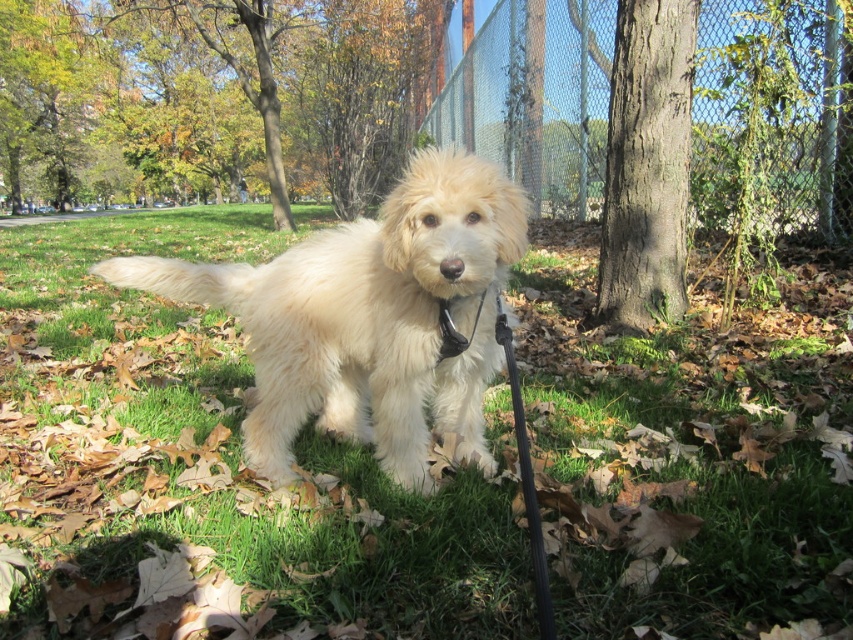
Does green grass at center appear on the right side of fluffy white dog at center?

In fact, green grass at center is to the left of fluffy white dog at center.

From the picture: Is green grass at center shorter than fluffy white dog at center?

In fact, green grass at center may be taller than fluffy white dog at center.

Between point (784, 554) and point (331, 392), which one is positioned in front?

Point (784, 554) is in front.

Identify the location of green grass at center. This screenshot has height=640, width=853. (212, 468).

Based on the photo, can you confirm if fluffy white dog at center is shorter than metallic chain-link fence at center-right?

Correct, fluffy white dog at center is not as tall as metallic chain-link fence at center-right.

Who is more forward, (445, 157) or (495, 12)?

Point (445, 157)

The width and height of the screenshot is (853, 640). Find the location of `fluffy white dog at center`. fluffy white dog at center is located at coordinates (368, 317).

Identify the location of fluffy white dog at center. The height and width of the screenshot is (640, 853). [x=368, y=317].

Looking at this image, who is higher up, fluffy white dog at center or black leather neckband at center?

Positioned higher is black leather neckband at center.

Find the location of `fluffy white dog at center`. fluffy white dog at center is located at coordinates (368, 317).

This screenshot has width=853, height=640. Identify the location of fluffy white dog at center. (368, 317).